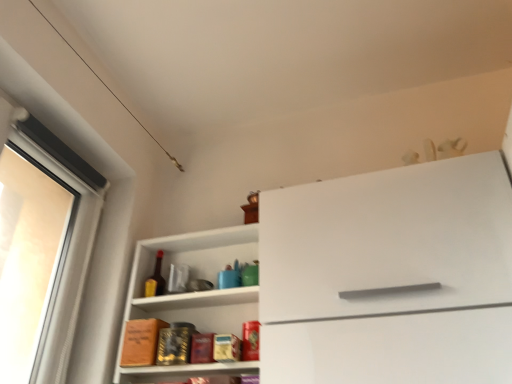
Question: Is there a large distance between white matte cabinet at center and white glossy shelf at center?

Choices:
 (A) no
 (B) yes

Answer: (A)

Question: Considering the relative sizes of white matte cabinet at center and white glossy shelf at center in the image provided, is white matte cabinet at center thinner than white glossy shelf at center?

Choices:
 (A) yes
 (B) no

Answer: (B)

Question: Is white matte cabinet at center smaller than white glossy shelf at center?

Choices:
 (A) no
 (B) yes

Answer: (A)

Question: From a real-world perspective, is white matte cabinet at center positioned over white glossy shelf at center based on gravity?

Choices:
 (A) yes
 (B) no

Answer: (B)

Question: Is white matte cabinet at center wider than white glossy shelf at center?

Choices:
 (A) no
 (B) yes

Answer: (B)

Question: Relative to white glossy shelf at center, is white matte cabinet at center in front or behind?

Choices:
 (A) behind
 (B) front

Answer: (B)

Question: Is white matte cabinet at center inside the boundaries of white glossy shelf at center, or outside?

Choices:
 (A) outside
 (B) inside

Answer: (A)

Question: Considering the positions of white matte cabinet at center and white glossy shelf at center in the image, is white matte cabinet at center wider or thinner than white glossy shelf at center?

Choices:
 (A) wide
 (B) thin

Answer: (A)

Question: From a real-world perspective, is white matte cabinet at center physically located above or below white glossy shelf at center?

Choices:
 (A) above
 (B) below

Answer: (B)

Question: Looking at the image, does white glossy shelf at center seem bigger or smaller compared to white matte cabinet at center?

Choices:
 (A) big
 (B) small

Answer: (B)

Question: Is point [131, 379] closer or farther from the camera than point [340, 256]?

Choices:
 (A) closer
 (B) farther

Answer: (B)

Question: Is white glossy shelf at center taller or shorter than white matte cabinet at center?

Choices:
 (A) short
 (B) tall

Answer: (A)

Question: In the image, is white glossy shelf at center on the left side or the right side of white matte cabinet at center?

Choices:
 (A) right
 (B) left

Answer: (B)

Question: Choose the correct answer: Is matte glass bottle at center inside white matte cabinet at center or outside it?

Choices:
 (A) outside
 (B) inside

Answer: (A)

Question: From a real-world perspective, is matte glass bottle at center physically located above or below white matte cabinet at center?

Choices:
 (A) below
 (B) above

Answer: (B)